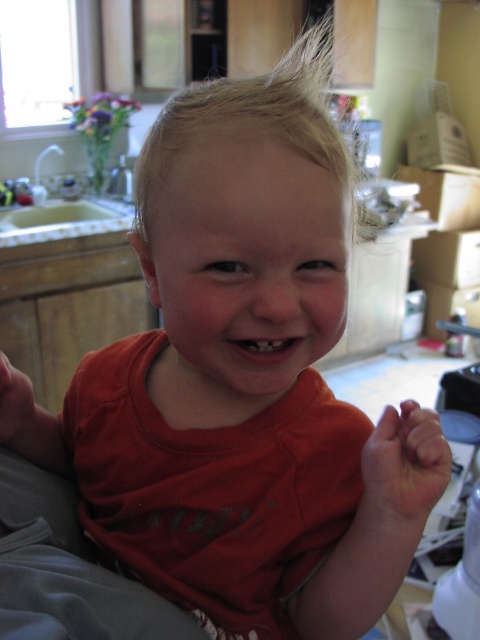
You are a chef preparing to place a 15 cm wide plate on the countertop. You see the smooth skin hand at lower right and the matte orange shirt at lower left. Which object has enough width to accommodate the plate without overlapping?

The smooth skin hand at lower right has a width surpassing the matte orange shirt at lower left, so the smooth skin hand at lower right can accommodate the 15 cm wide plate without overlapping.